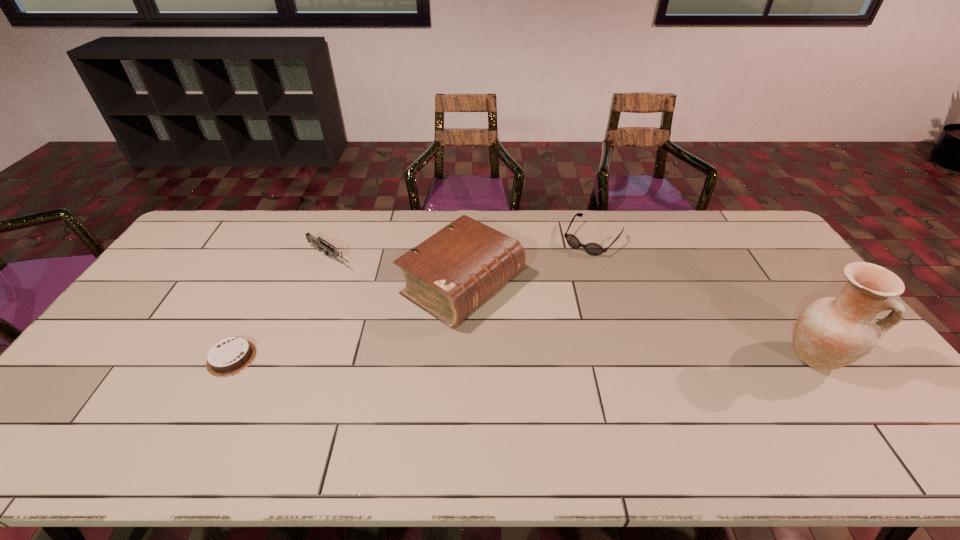
Where is `free space located aimed along the barrel of the second object from left to right`? free space located aimed along the barrel of the second object from left to right is located at coordinates (412, 307).

Where is `Bible located at the far edge`? The width and height of the screenshot is (960, 540). Bible located at the far edge is located at coordinates (452, 273).

This screenshot has width=960, height=540. I want to click on sunglasses at the far edge, so (594, 249).

Where is `gun present at the far edge`? gun present at the far edge is located at coordinates (317, 242).

The width and height of the screenshot is (960, 540). In order to click on object at the right edge in this screenshot , I will do `click(831, 332)`.

Image resolution: width=960 pixels, height=540 pixels. Identify the location of vacant space at the far edge of the desktop. (323, 212).

In the image, there is a desktop. At what (x,y) coordinates should I click in order to perform the action: click on free space at the near edge. Please return your answer as a coordinate pair (x, y). Image resolution: width=960 pixels, height=540 pixels. Looking at the image, I should click on (494, 415).

Locate an element on the screen. vacant space at the left edge of the desktop is located at coordinates click(158, 302).

Find the location of `blank space at the right edge`. blank space at the right edge is located at coordinates (774, 292).

This screenshot has width=960, height=540. Find the location of `blank area at the far left corner`. blank area at the far left corner is located at coordinates (224, 212).